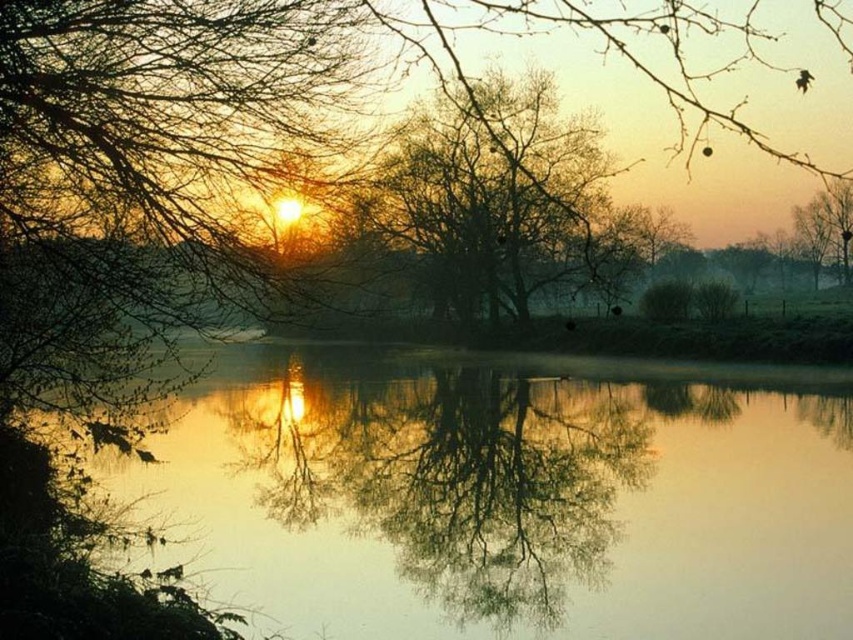
Can you confirm if silvery reflective water at center is bigger than bare branches at center?

Incorrect, silvery reflective water at center is not larger than bare branches at center.

Is silvery reflective water at center wider than bare branches at center?

Yes, silvery reflective water at center is wider than bare branches at center.

Between point (421, 528) and point (465, 275), which one is positioned behind?

The point (465, 275) is more distant.

Locate an element on the screen. The image size is (853, 640). silvery reflective water at center is located at coordinates (503, 496).